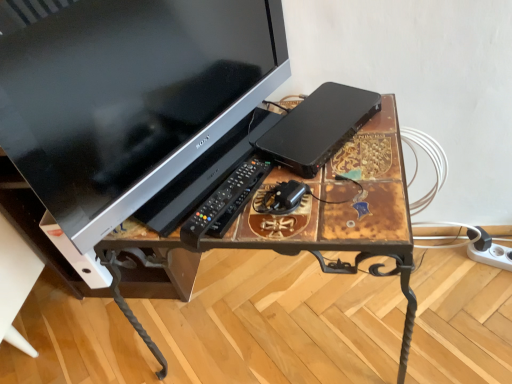
Question: Considering the relative positions of black plastic computer at center and black plastic power adapter at center in the image provided, is black plastic computer at center to the left or to the right of black plastic power adapter at center?

Choices:
 (A) left
 (B) right

Answer: (B)

Question: Based on their sizes in the image, would you say black plastic computer at center is bigger or smaller than black plastic power adapter at center?

Choices:
 (A) small
 (B) big

Answer: (B)

Question: Considering the real-world distances, which object is farthest from the white plastic extension cord at lower right?

Choices:
 (A) rustic wood desk at center
 (B) black plastic remote at center
 (C) black plastic power adapter at center
 (D) black plastic computer at center
 (E) satin black monitor at upper left

Answer: (E)

Question: Which object is positioned farthest from the satin black monitor at upper left?

Choices:
 (A) black plastic power adapter at center
 (B) black plastic computer at center
 (C) white plastic extension cord at lower right
 (D) black plastic remote at center
 (E) rustic wood desk at center

Answer: (C)